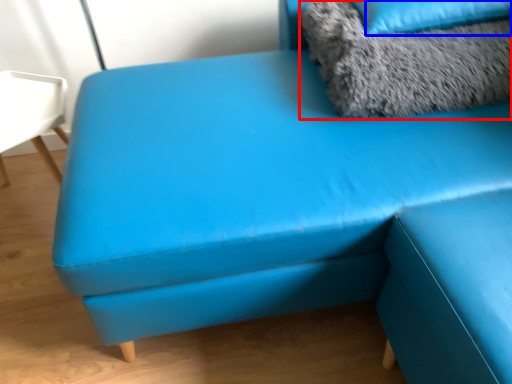
Question: Among these objects, which one is nearest to the camera, animal (highlighted by a red box) or pillow (highlighted by a blue box)?

Choices:
 (A) animal
 (B) pillow

Answer: (A)